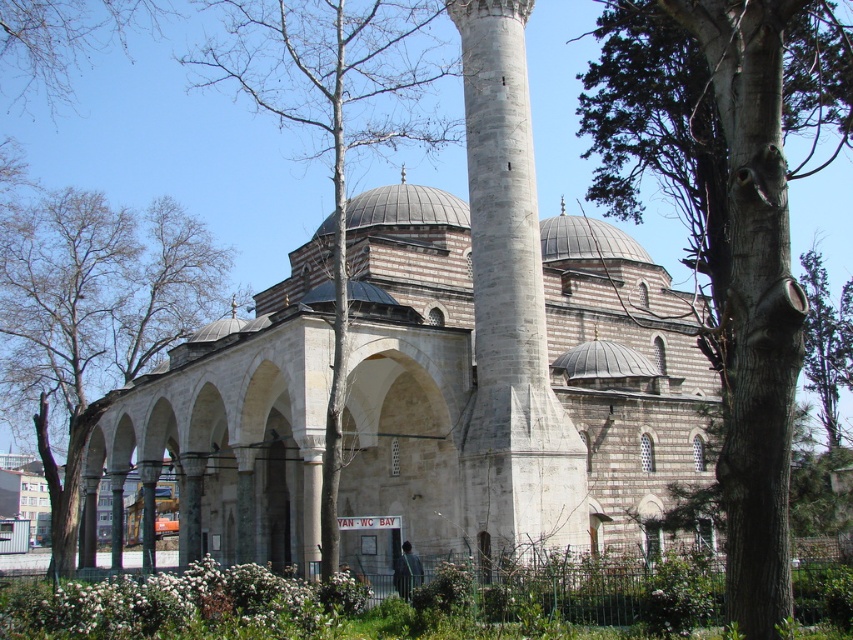
Can you confirm if smooth stone minaret at center is positioned below bare wood tree at center?

Correct, smooth stone minaret at center is located below bare wood tree at center.

The width and height of the screenshot is (853, 640). Describe the element at coordinates (509, 307) in the screenshot. I see `smooth stone minaret at center` at that location.

Where is `smooth stone minaret at center`? This screenshot has height=640, width=853. smooth stone minaret at center is located at coordinates (509, 307).

Looking at this image, which is above, green leafy tree at left or bare wood tree at center?

bare wood tree at center

Between point (20, 328) and point (328, 413), which one is positioned in front?

Point (328, 413)

Find the location of a particular element. This screenshot has height=640, width=853. green leafy tree at left is located at coordinates (91, 317).

Who is lower down, brown rough tree at center or green leafy tree at left?

green leafy tree at left is lower down.

Who is positioned more to the right, brown rough tree at center or green leafy tree at left?

Positioned to the right is brown rough tree at center.

The width and height of the screenshot is (853, 640). Describe the element at coordinates (728, 218) in the screenshot. I see `brown rough tree at center` at that location.

This screenshot has height=640, width=853. What are the coordinates of `brown rough tree at center` in the screenshot? It's located at (728, 218).